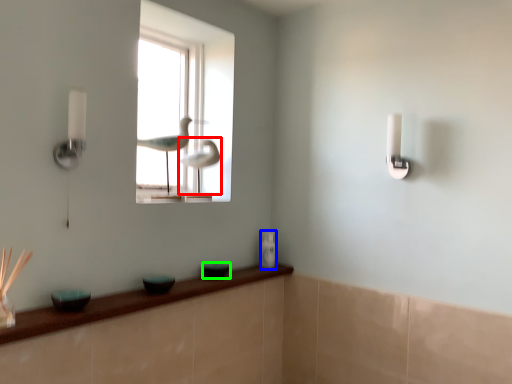
Question: Which is farther away from bird (highlighted by a red box)? toiletry (highlighted by a blue box) or glass bowl (highlighted by a green box)?

Choices:
 (A) toiletry
 (B) glass bowl

Answer: (B)